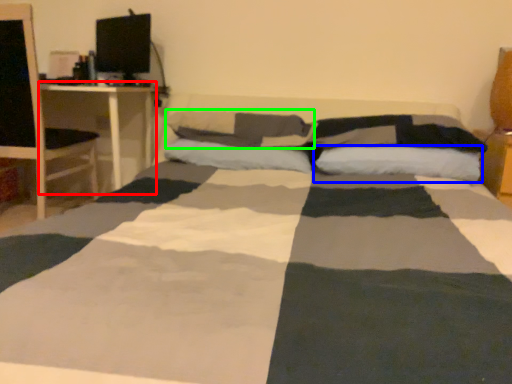
Question: Which object is the closest to the desk (highlighted by a red box)? Choose among these: pillow (highlighted by a blue box) or pillow (highlighted by a green box).

Choices:
 (A) pillow
 (B) pillow

Answer: (B)